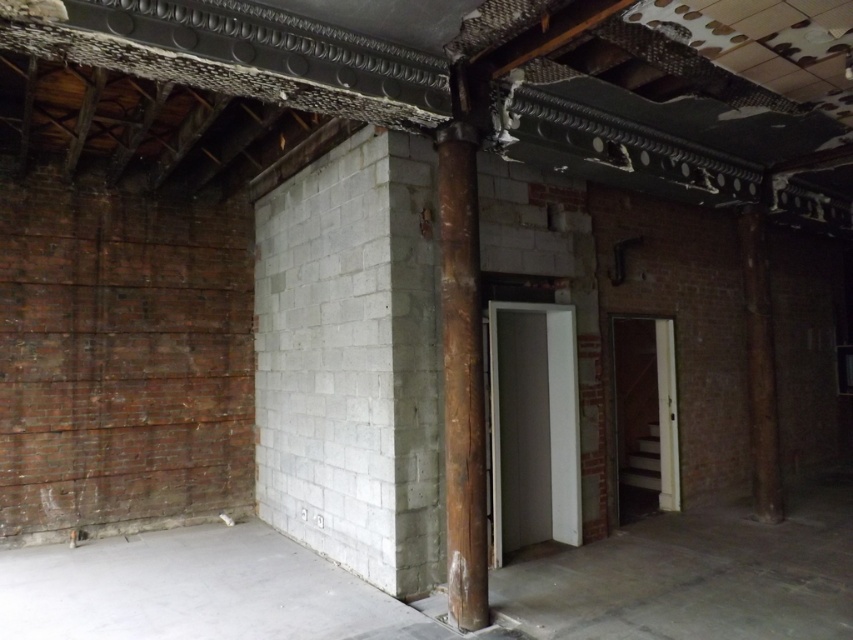
Does point (473, 413) come behind point (764, 476)?

No.

Does point (448, 413) come behind point (770, 509)?

No, (448, 413) is in front of (770, 509).

Identify the location of rusty wood pillar at center. This screenshot has height=640, width=853. (462, 344).